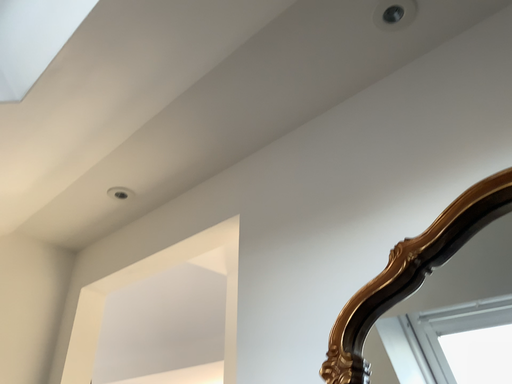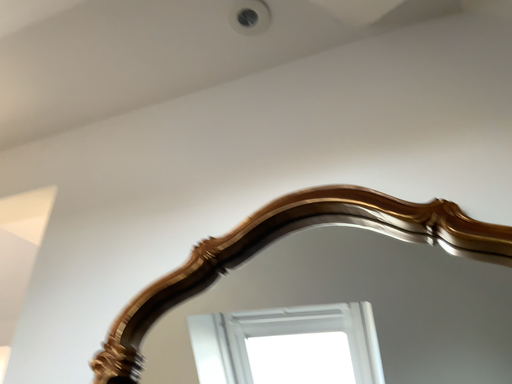
Question: Which way did the camera rotate in the video?

Choices:
 (A) rotated right
 (B) rotated left

Answer: (A)